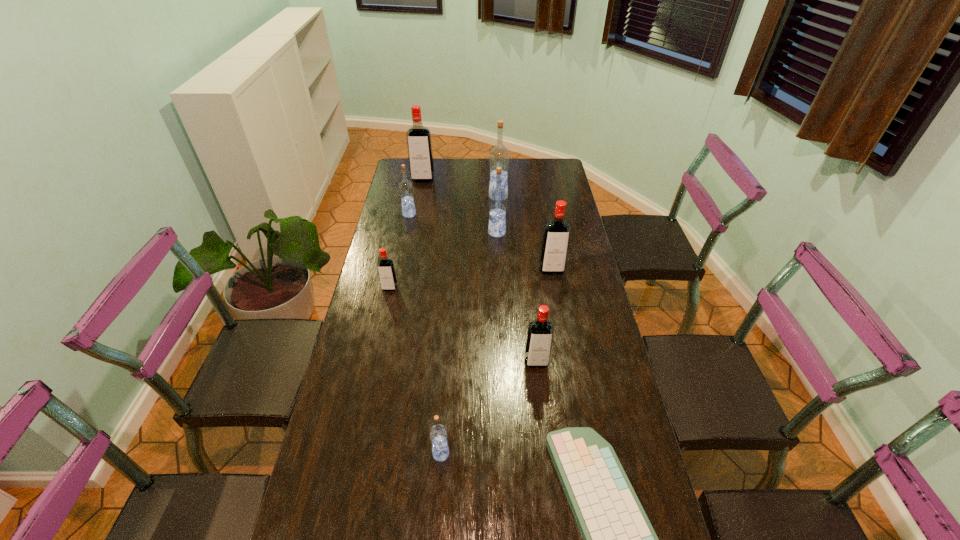
Where is `free space located 0.170m on the front of the second farthest blue vodka`? The height and width of the screenshot is (540, 960). free space located 0.170m on the front of the second farthest blue vodka is located at coordinates (403, 243).

Where is `free space located 0.260m on the front and back of the second nearest vodka`? The height and width of the screenshot is (540, 960). free space located 0.260m on the front and back of the second nearest vodka is located at coordinates (546, 453).

Where is `vacant area located on the front and back of the smallest red vodka`? Image resolution: width=960 pixels, height=540 pixels. vacant area located on the front and back of the smallest red vodka is located at coordinates (380, 333).

This screenshot has height=540, width=960. I want to click on vacant area located on the front of the fourth vodka from left to right, so pos(438,508).

Where is `object located in the far edge section of the desktop`? This screenshot has height=540, width=960. object located in the far edge section of the desktop is located at coordinates (419, 144).

Where is `object at the right edge`? This screenshot has width=960, height=540. object at the right edge is located at coordinates (556, 236).

The width and height of the screenshot is (960, 540). Identify the location of object that is at the far left corner. (419, 144).

Locate an element on the screen. The height and width of the screenshot is (540, 960). free space at the far edge of the desktop is located at coordinates (479, 166).

Locate an element on the screen. This screenshot has height=540, width=960. free location at the left edge of the desktop is located at coordinates (398, 249).

Where is `vacant space at the right edge of the desktop`? This screenshot has width=960, height=540. vacant space at the right edge of the desktop is located at coordinates (571, 219).